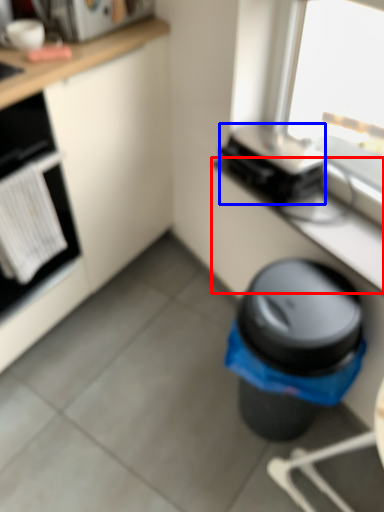
Question: Which point is closer to the camera, counter top (highlighted by a red box) or appliance (highlighted by a blue box)?

Choices:
 (A) counter top
 (B) appliance

Answer: (A)